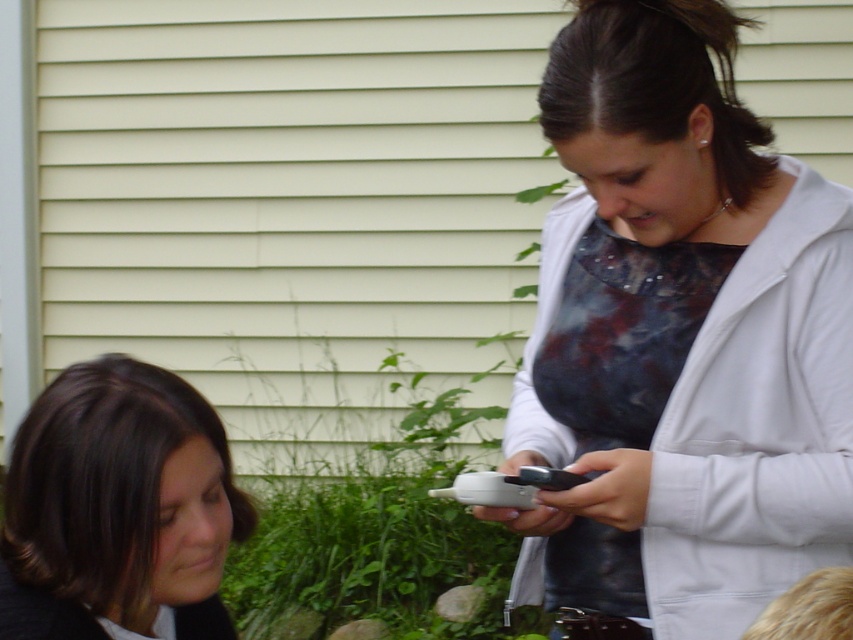
Is matte white jacket at upper right positioned in front of black plastic smartphone at upper right?

Yes, it is in front of black plastic smartphone at upper right.

Is point (683, 344) positioned behind point (589, 477)?

No, (683, 344) is in front of (589, 477).

Measure the distance between point (808,304) and camera.

Point (808,304) is 1.76 meters away from camera.

In order to click on matte white jacket at upper right in this screenshot , I will do `click(679, 337)`.

Is dark brown hair at lower left wider than black plastic smartphone at upper right?

Yes, dark brown hair at lower left is wider than black plastic smartphone at upper right.

Is point (126, 602) behind point (527, 467)?

No, it is in front of (527, 467).

Locate an element on the screen. dark brown hair at lower left is located at coordinates (119, 508).

Is matte white jacket at upper right bigger than dark brown hair at lower left?

Indeed, matte white jacket at upper right has a larger size compared to dark brown hair at lower left.

Does matte white jacket at upper right have a lesser height compared to dark brown hair at lower left?

In fact, matte white jacket at upper right may be taller than dark brown hair at lower left.

Which is behind, point (727, 83) or point (183, 481)?

The point (727, 83) is more distant.

You are a GUI agent. You are given a task and a screenshot of the screen. Output one action in this format:
    pyautogui.click(x=<x>, y=<y>)
    Task: Click on the matte white jacket at upper right
    This screenshot has height=640, width=853.
    Given the screenshot: What is the action you would take?
    pyautogui.click(x=679, y=337)